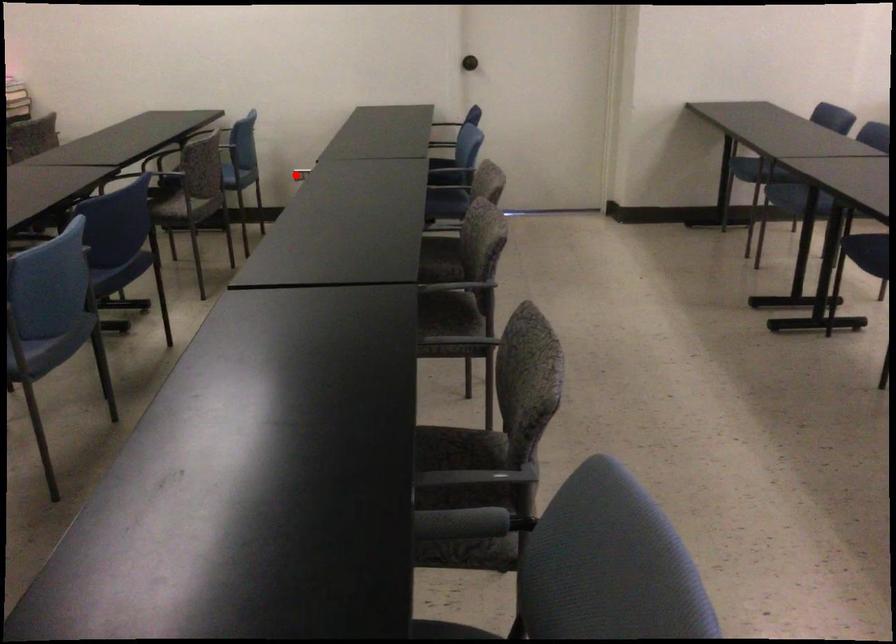
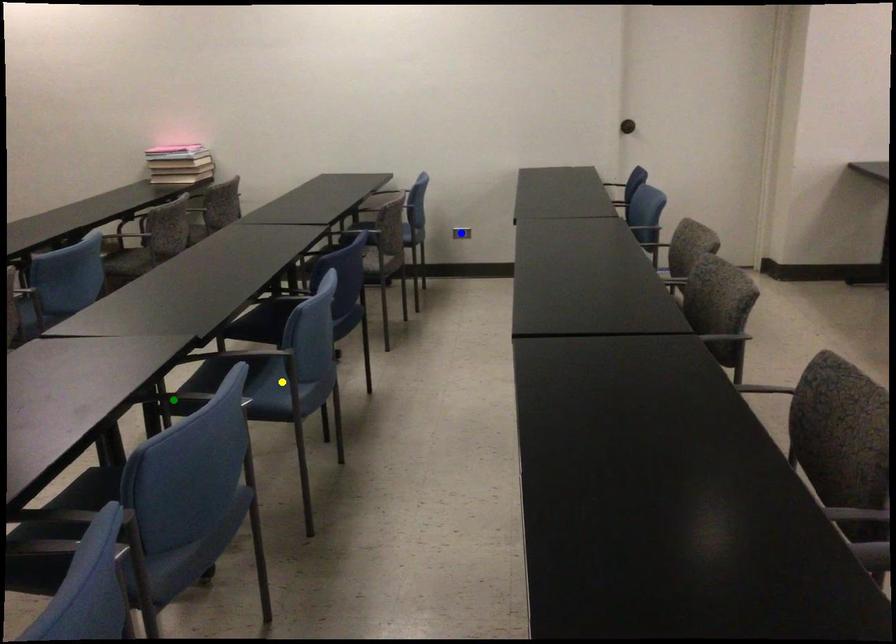
Question: I am providing you with two images of the same scene from different viewpoints. A red point is marked on the first image. You are given multiple points on the second image. Which point in image 2 is actually the same real-world point as the red point in image 1?

Choices:
 (A) yellow point
 (B) blue point
 (C) green point

Answer: (B)